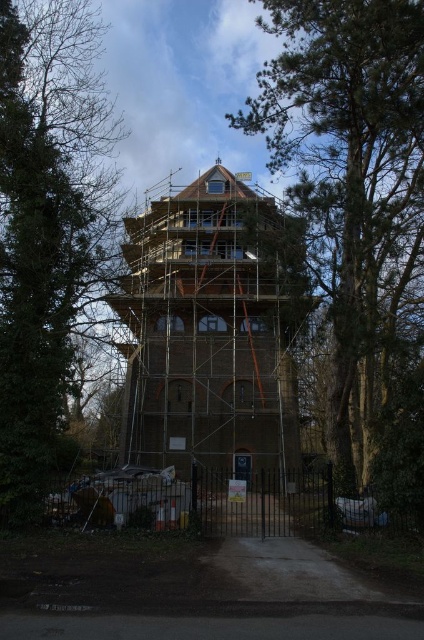
You are a delivery person trying to enter the construction site through the concrete gate at center. The brown brick tower at center is part of the building you need to deliver materials to. Since the gate is narrow, will your 2.5 meter wide delivery truck fit through the gate?

The concrete gate at center has a lesser width compared to brown brick tower at center. Since the truck is 2.5 meters wide, it depends on the actual width of the gate. However, without specific measurements, we cannot confirm if it will fit. Please check the gate width before proceeding.

You are a construction worker standing on the ground floor of the building. You need to determine which tree, the green textured tree at upper center or the green leafy tree at left, you can see above the scaffolding. Based on their heights, which tree is more likely visible?

The green textured tree at upper center is much taller than the green leafy tree at left, so it is more likely visible above the scaffolding.

You are a painter standing at the base of the building and want to paint both the green textured tree at upper center and the green leafy tree at left. Which tree will require you to look upwards more?

The green textured tree at upper center will require looking upwards more because it is bigger than the green leafy tree at left.